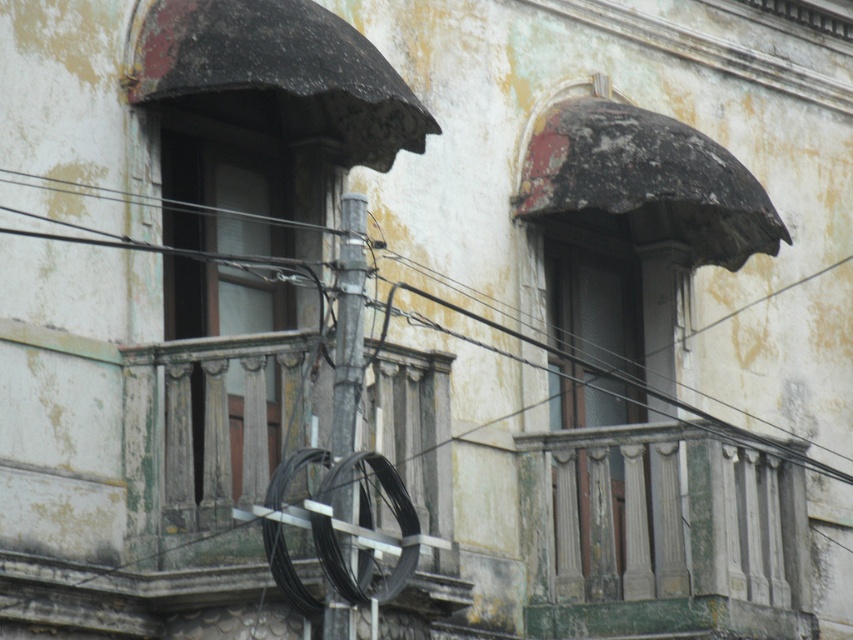
Question: Does black wire at left appear on the right side of metallic gray pole at center?

Choices:
 (A) yes
 (B) no

Answer: (A)

Question: Does rusty metal awning at upper right appear under black wire at left?

Choices:
 (A) yes
 (B) no

Answer: (B)

Question: Does rusty metal awning at upper right lie behind metallic gray pole at center?

Choices:
 (A) yes
 (B) no

Answer: (A)

Question: Among these points, which one is nearest to the camera?

Choices:
 (A) (340, 29)
 (B) (405, 499)
 (C) (786, 630)
 (D) (583, 166)

Answer: (B)

Question: Among these points, which one is farthest from the camera?

Choices:
 (A) (631, 140)
 (B) (604, 548)
 (C) (234, 218)

Answer: (A)

Question: Which point appears farthest from the camera in this image?

Choices:
 (A) (425, 298)
 (B) (312, 458)
 (C) (614, 198)
 (D) (668, 500)

Answer: (C)